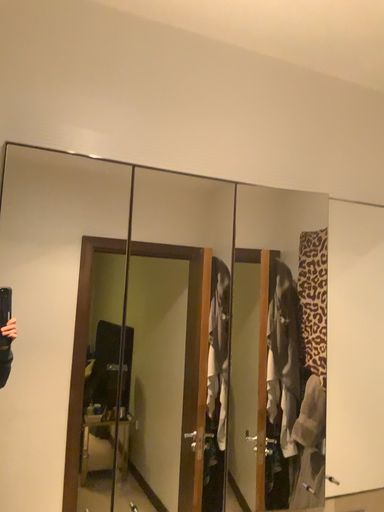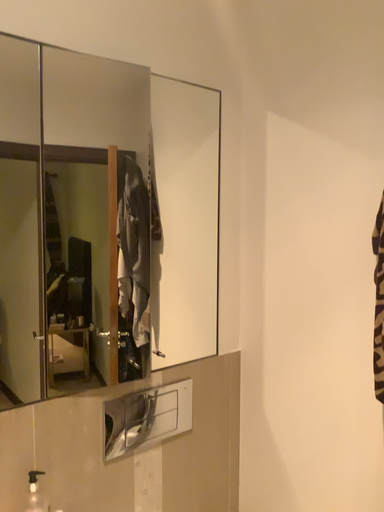
Question: How did the camera likely rotate when shooting the video?

Choices:
 (A) rotated upward
 (B) rotated downward

Answer: (B)